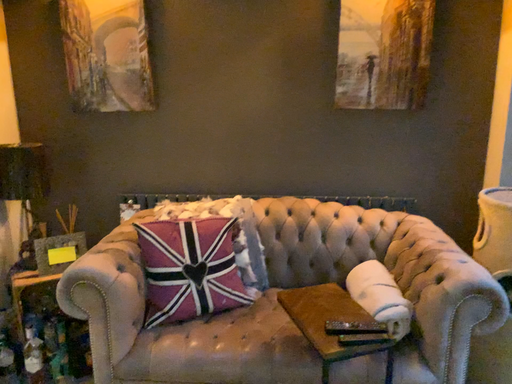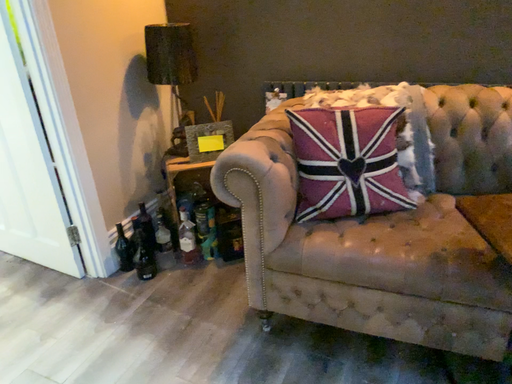
Question: Which way did the camera rotate in the video?

Choices:
 (A) rotated downward
 (B) rotated upward

Answer: (A)